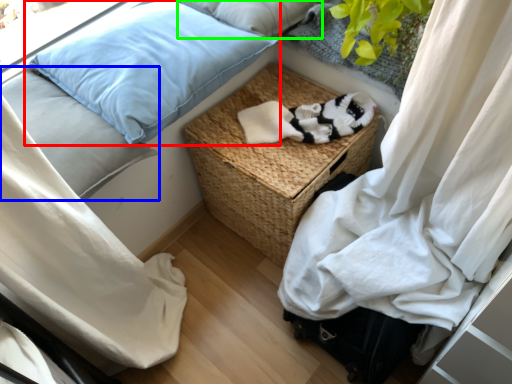
Question: Which object is positioned closest to pillow (highlighted by a red box)? Select from pillow (highlighted by a blue box) and pillow (highlighted by a green box).

Choices:
 (A) pillow
 (B) pillow

Answer: (A)